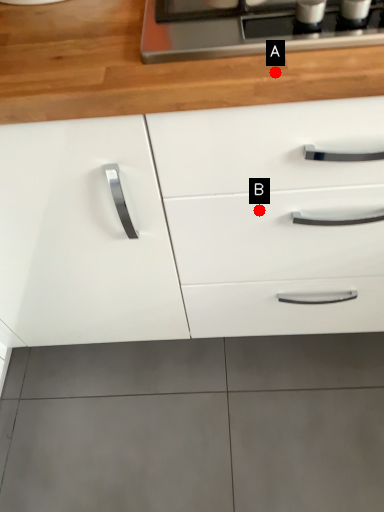
Question: Two points are circled on the image, labeled by A and B beside each circle. Which point is farther to the camera?

Choices:
 (A) A is further
 (B) B is further

Answer: (B)